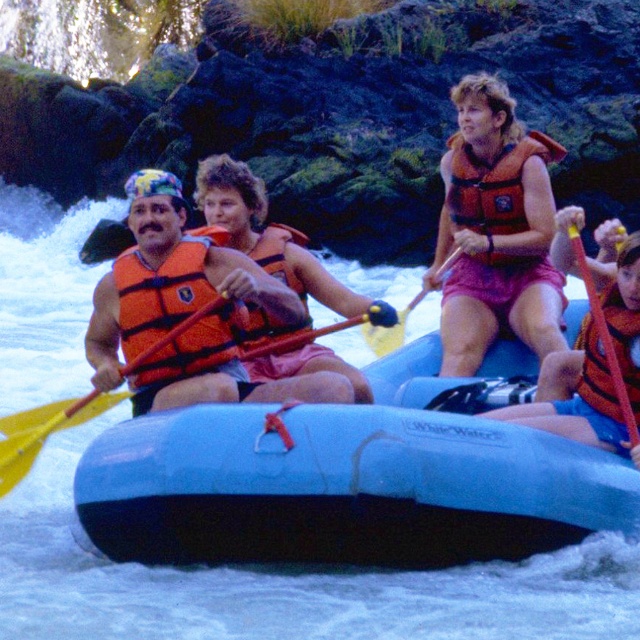
Question: Among these points, which one is nearest to the camera?

Choices:
 (A) (506, 474)
 (B) (250, 237)

Answer: (A)

Question: Which object is farther from the camera taking this photo?

Choices:
 (A) yellow plastic paddle at center
 (B) orange life vest at upper center

Answer: (B)

Question: Does orange life vest at right have a greater width compared to orange life jacket at upper center?

Choices:
 (A) no
 (B) yes

Answer: (B)

Question: Among these objects, which one is nearest to the camera?

Choices:
 (A) orange life vest at upper center
 (B) orange life jacket at upper center
 (C) blue rubber boat at center
 (D) orange life vest at center

Answer: (C)

Question: Observing the image, what is the correct spatial positioning of orange life vest at upper center in reference to yellow plastic paddle at center?

Choices:
 (A) above
 (B) below

Answer: (A)

Question: Considering the relative positions of orange life vest at right and yellow plastic paddle at left in the image provided, where is orange life vest at right located with respect to yellow plastic paddle at left?

Choices:
 (A) right
 (B) left

Answer: (A)